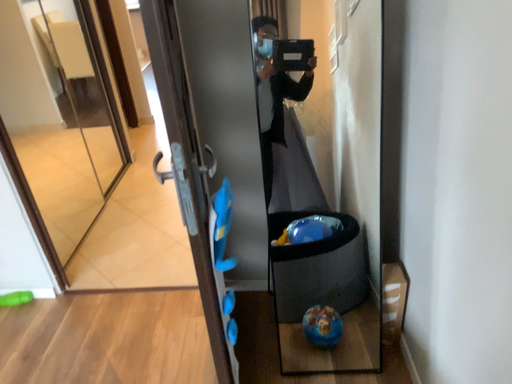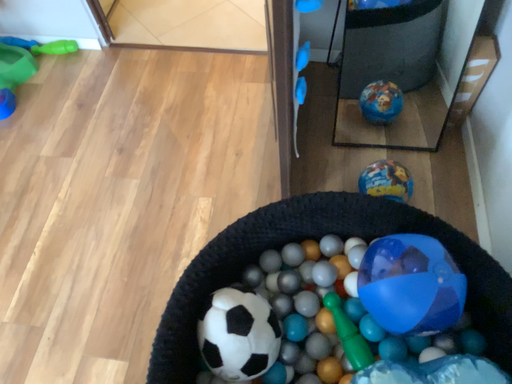
Question: Which way did the camera rotate in the video?

Choices:
 (A) rotated upward
 (B) rotated downward

Answer: (B)